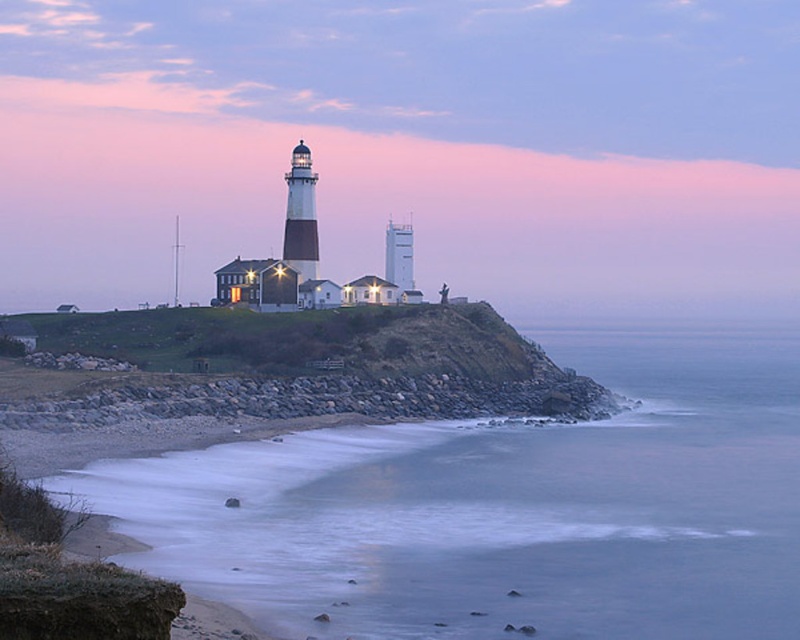
You are a painter setting up your easel to capture the coastal scene. You want to ensure that the white matte lighthouse at center and the gray rock wall at lower center are both visible in your painting. Given their relative widths, which object should you position closer to the center of your canvas to maintain balance?

Since the white matte lighthouse at center is wider than the gray rock wall at lower center, positioning the lighthouse closer to the center of the canvas will help balance the composition, as its greater width can anchor the scene effectively.

You are a photographer planning to capture the lighthouse from the shore. You have a camera with a wide angle lens that can capture large areas. Which object, the blue smooth water at lower left or the gray rock wall at lower center, would be better to include in your shot to showcase the vastness of the scene?

The blue smooth water at lower left is larger in size than the gray rock wall at lower center, so including it would better showcase the vastness of the scene.